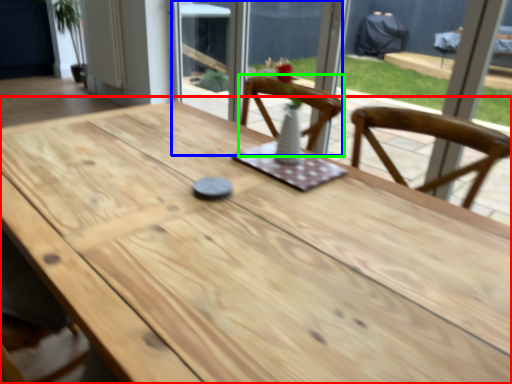
Question: Which object is positioned closest to table (highlighted by a red box)? Select from screen door (highlighted by a blue box) and chair (highlighted by a green box).

Choices:
 (A) screen door
 (B) chair

Answer: (B)